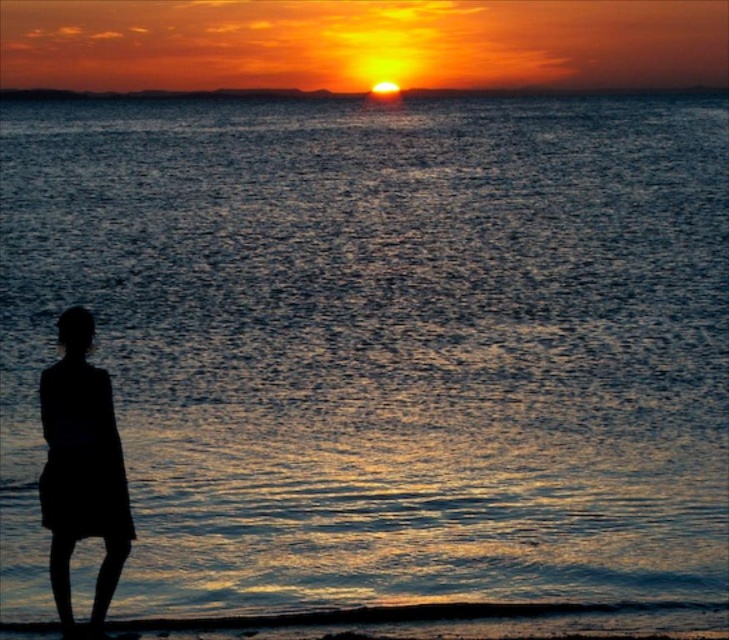
Between silhouette dress at left and smooth orange sky at center, which one is positioned lower?

Positioned lower is silhouette dress at left.

Which is behind, point (128, 525) or point (31, 96)?

The point (31, 96) is behind.

The height and width of the screenshot is (640, 729). In order to click on silhouette dress at left in this screenshot , I will do `click(81, 468)`.